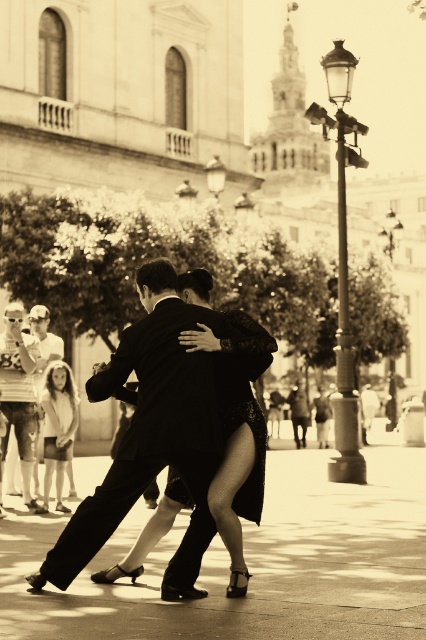
Who is positioned more to the right, black satin suit at center or matte black suit at left?

black satin suit at center is more to the right.

Locate an element on the screen. Image resolution: width=426 pixels, height=640 pixels. black satin suit at center is located at coordinates (152, 433).

At what (x,y) coordinates should I click in order to perform the action: click on black satin suit at center. Please return your answer as a coordinate pair (x, y). The width and height of the screenshot is (426, 640). Looking at the image, I should click on (152, 433).

Can you confirm if black lace dress at center is thinner than light beige fabric dress at lower left?

No.

Is black lace dress at center closer to camera compared to light beige fabric dress at lower left?

Yes, it is.

Does point (164, 576) come in front of point (74, 400)?

That is True.

Where is `black lace dress at center`? black lace dress at center is located at coordinates (238, 433).

Does matte black suit at left appear on the left side of light beige fabric dress at lower left?

Yes, matte black suit at left is to the left of light beige fabric dress at lower left.

This screenshot has width=426, height=640. Find the location of `matte black suit at left`. matte black suit at left is located at coordinates pyautogui.click(x=19, y=390).